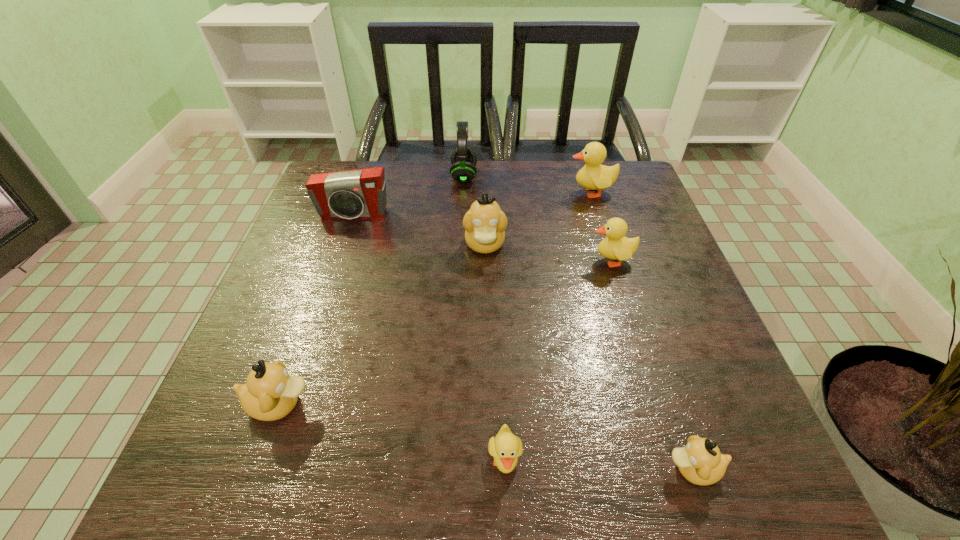
Where is `duckling that is at the left edge`? duckling that is at the left edge is located at coordinates (270, 393).

At what (x,y) coordinates should I click in order to perform the action: click on object that is at the far left corner. Please return your answer as a coordinate pair (x, y). Looking at the image, I should click on (361, 193).

Locate an element on the screen. object that is at the far right corner is located at coordinates (593, 176).

Identify the location of object that is at the near right corner. (700, 462).

The image size is (960, 540). I want to click on vacant space at the far edge, so click(x=571, y=190).

In the image, there is a desktop. At what (x,y) coordinates should I click in order to perform the action: click on free region at the left edge. Please return your answer as a coordinate pair (x, y). The image size is (960, 540). Looking at the image, I should click on (290, 262).

You are a GUI agent. You are given a task and a screenshot of the screen. Output one action in this format:
    pyautogui.click(x=<x>, y=<y>)
    Task: Click on the vacant area at the right edge of the desktop
    
    Given the screenshot: What is the action you would take?
    coord(680,299)

This screenshot has width=960, height=540. I want to click on free space at the near left corner of the desktop, so click(184, 495).

You are a GUI agent. You are given a task and a screenshot of the screen. Output one action in this format:
    pyautogui.click(x=<x>, y=<y>)
    Task: Click on the vacant space at the far right corner of the desktop
    
    Given the screenshot: What is the action you would take?
    pyautogui.click(x=598, y=201)

You are a GUI agent. You are given a task and a screenshot of the screen. Output one action in this format:
    pyautogui.click(x=<x>, y=<y>)
    Task: Click on the vacant space at the near right corner
    The width and height of the screenshot is (960, 540).
    Given the screenshot: What is the action you would take?
    pyautogui.click(x=756, y=481)